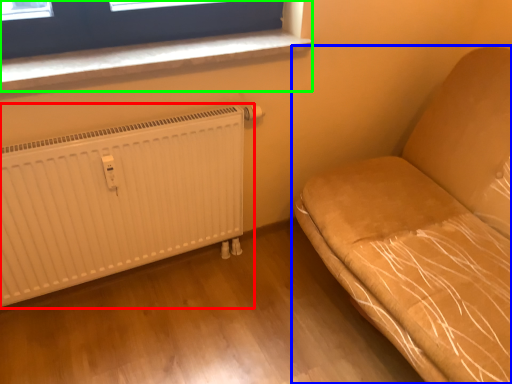
Question: Estimate the real-world distances between objects in this image. Which object is farther from radiator (highlighted by a red box), furniture (highlighted by a blue box) or window (highlighted by a green box)?

Choices:
 (A) furniture
 (B) window

Answer: (A)